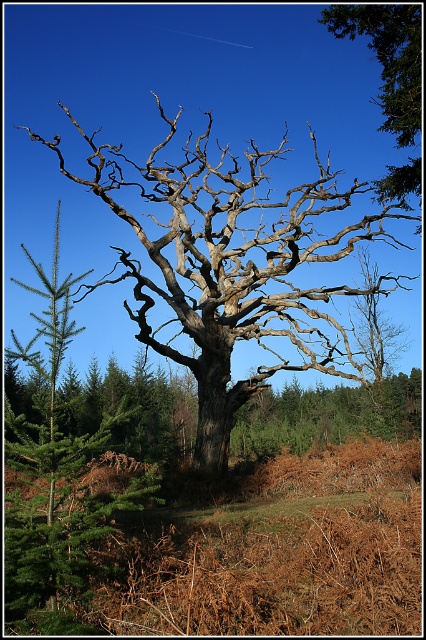
You are a park ranger assessing the health of the trees in the area. You observe the dead wood tree at center and the brown textured bark at upper right. Which of these two has a greater width?

The dead wood tree at center has a greater width than the brown textured bark at upper right.

You are an environmental scientist assessing the health of the forest. You notice the dead wood tree at center and the brown textured bark at upper right. Which of these two objects is positioned to the east?

The dead wood tree at center is to the left of brown textured bark at upper right. Since the image is viewed from a standard perspective, left corresponds to east. Therefore, the dead wood tree at center is positioned to the east.

Based on the photo, you are an environmental scientist examining the image. You need to determine the relative positions of the dead wood tree at center and the brown textured bark at upper right. Based on the scene, which object is positioned higher up in the image?

The brown textured bark at upper right is positioned higher up in the image than the dead wood tree at center.